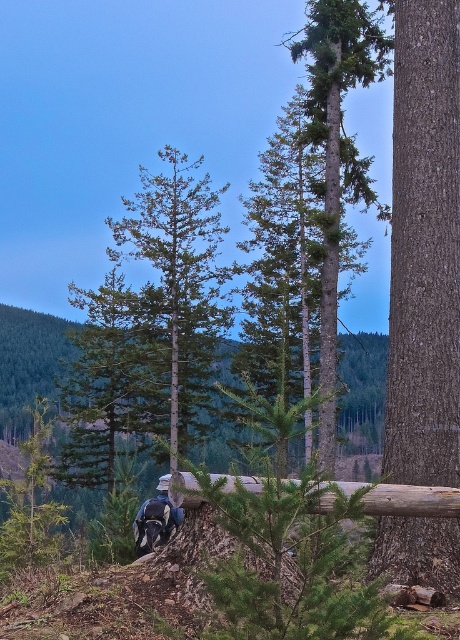
Question: Does smooth brown tree trunk at right appear on the right side of dark blue fabric mountain biker at center?

Choices:
 (A) yes
 (B) no

Answer: (A)

Question: Is smooth brown tree trunk at right positioned at the back of dark blue fabric mountain biker at center?

Choices:
 (A) yes
 (B) no

Answer: (A)

Question: Considering the relative positions of smooth brown tree trunk at right and dark blue fabric mountain biker at center in the image provided, where is smooth brown tree trunk at right located with respect to dark blue fabric mountain biker at center?

Choices:
 (A) right
 (B) left

Answer: (A)

Question: Which point appears farthest from the camera in this image?

Choices:
 (A) (452, 156)
 (B) (155, 541)

Answer: (A)